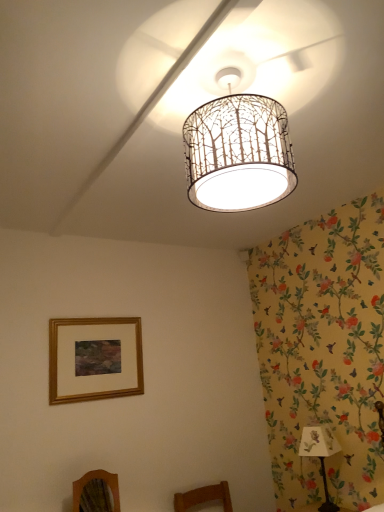
What do you see at coordinates (94, 359) in the screenshot? This screenshot has width=384, height=512. I see `gold wooden picture frame at lower left` at bounding box center [94, 359].

At what (x,y) coordinates should I click in order to perform the action: click on white paper shade at lower right. Please return your answer as a coordinate pair (x, y). Looking at the image, I should click on (320, 454).

Measure the distance between white paper shade at lower right and camera.

A distance of 8.10 feet exists between white paper shade at lower right and camera.

Find the location of a particular element. The height and width of the screenshot is (512, 384). gold wooden picture frame at lower left is located at coordinates (94, 359).

Which is behind, point (76, 490) or point (122, 360)?

Point (122, 360)

Could you tell me if wooden mirror at lower left is facing gold wooden picture frame at lower left?

No, wooden mirror at lower left is not turned towards gold wooden picture frame at lower left.

Locate an element on the screen. furniture that appears in front of the gold wooden picture frame at lower left is located at coordinates (96, 492).

From a real-world perspective, does wooden mirror at lower left stand above gold wooden picture frame at lower left?

No, from a real-world perspective, wooden mirror at lower left is not over gold wooden picture frame at lower left

Locate an element on the screen. This screenshot has width=384, height=512. picture frame located above the white paper shade at lower right (from the image's perspective) is located at coordinates (94, 359).

Is gold wooden picture frame at lower left at the back of white paper shade at lower right?

No.

Considering the positions of objects white paper shade at lower right and gold wooden picture frame at lower left in the image provided, who is more to the left, white paper shade at lower right or gold wooden picture frame at lower left?

gold wooden picture frame at lower left is more to the left.

Does white paper lampshade at center touch gold wooden picture frame at lower left?

No, white paper lampshade at center is not next to gold wooden picture frame at lower left.

Which object is closer to the camera taking this photo, white paper lampshade at center or gold wooden picture frame at lower left?

white paper lampshade at center.

Would you say gold wooden picture frame at lower left is part of white paper lampshade at center's contents?

No, gold wooden picture frame at lower left is not surrounded by white paper lampshade at center.

Looking at the image, does white paper lampshade at center seem bigger or smaller compared to gold wooden picture frame at lower left?

In the image, white paper lampshade at center appears to be larger than gold wooden picture frame at lower left.

Considering the sizes of objects white paper lampshade at center and wooden mirror at lower left in the image provided, who is wider, white paper lampshade at center or wooden mirror at lower left?

white paper lampshade at center is wider.

You are a GUI agent. You are given a task and a screenshot of the screen. Output one action in this format:
    pyautogui.click(x=<x>, y=<y>)
    Task: Click on the lamp in front of the wooden mirror at lower left
    
    Given the screenshot: What is the action you would take?
    pyautogui.click(x=238, y=151)

Does white paper lampshade at center turn towards wooden mirror at lower left?

No, white paper lampshade at center is not turned towards wooden mirror at lower left.

Is white paper lampshade at center inside the boundaries of wooden mirror at lower left, or outside?

white paper lampshade at center lies outside wooden mirror at lower left.

Is gold wooden picture frame at lower left next to white paper lampshade at center and touching it?

No, gold wooden picture frame at lower left is not touching white paper lampshade at center.

Considering the sizes of objects gold wooden picture frame at lower left and white paper lampshade at center in the image provided, who is taller, gold wooden picture frame at lower left or white paper lampshade at center?

With more height is gold wooden picture frame at lower left.

Which object is further away from the camera, gold wooden picture frame at lower left or white paper lampshade at center?

gold wooden picture frame at lower left.

Which of these two, gold wooden picture frame at lower left or white paper lampshade at center, is bigger?

With larger size is white paper lampshade at center.

Would you say white paper lampshade at center contains white paper shade at lower right?

No, white paper shade at lower right is not a part of white paper lampshade at center.

Considering the positions of point (221, 101) and point (336, 452), is point (221, 101) closer or farther from the camera than point (336, 452)?

Point (221, 101) appears to be closer to the viewer than point (336, 452).

Is white paper lampshade at center oriented away from white paper shade at lower right?

No, white paper lampshade at center's orientation is not away from white paper shade at lower right.

From a real-world perspective, between white paper lampshade at center and white paper shade at lower right, who is vertically lower?

white paper shade at lower right.

From a real-world perspective, is gold wooden picture frame at lower left above or below white paper shade at lower right?

From a real-world perspective, gold wooden picture frame at lower left is physically above white paper shade at lower right.

Is gold wooden picture frame at lower left aimed at white paper shade at lower right?

No, gold wooden picture frame at lower left is not facing towards white paper shade at lower right.

You are a GUI agent. You are given a task and a screenshot of the screen. Output one action in this format:
    pyautogui.click(x=<x>, y=<y>)
    Task: Click on the table lamp below the gold wooden picture frame at lower left (from the image's perspective)
    The height and width of the screenshot is (512, 384).
    Given the screenshot: What is the action you would take?
    pyautogui.click(x=320, y=454)

This screenshot has height=512, width=384. Identify the location of picture frame above the wooden mirror at lower left (from a real-world perspective). (94, 359).

I want to click on table lamp beneath the gold wooden picture frame at lower left (from a real-world perspective), so click(320, 454).

Looking at this image, based on their spatial positions, is white paper shade at lower right or gold wooden picture frame at lower left further from white paper lampshade at center?

white paper shade at lower right is further to white paper lampshade at center.

Considering their positions, is white paper lampshade at center positioned further to wooden mirror at lower left than white paper shade at lower right?

white paper lampshade at center is further to wooden mirror at lower left.

Based on their spatial positions, is gold wooden picture frame at lower left or wooden mirror at lower left further from white paper lampshade at center?

wooden mirror at lower left lies further to white paper lampshade at center than the other object.

Looking at the image, which one is located closer to white paper shade at lower right, gold wooden picture frame at lower left or white paper lampshade at center?

Among the two, gold wooden picture frame at lower left is located nearer to white paper shade at lower right.

When comparing their distances from white paper lampshade at center, does wooden mirror at lower left or gold wooden picture frame at lower left seem closer?

The object closer to white paper lampshade at center is gold wooden picture frame at lower left.

Considering their positions, is wooden mirror at lower left positioned further to white paper shade at lower right than white paper lampshade at center?

Based on the image, white paper lampshade at center appears to be further to white paper shade at lower right.

Based on their spatial positions, is gold wooden picture frame at lower left or white paper shade at lower right further from white paper lampshade at center?

white paper shade at lower right is further to white paper lampshade at center.

Estimate the real-world distances between objects in this image. Which object is further from white paper lampshade at center, wooden mirror at lower left or white paper shade at lower right?

Among the two, white paper shade at lower right is located further to white paper lampshade at center.

Where is `picture frame between white paper lampshade at center and white paper shade at lower right from top to bottom`? The width and height of the screenshot is (384, 512). picture frame between white paper lampshade at center and white paper shade at lower right from top to bottom is located at coordinates (94, 359).

This screenshot has width=384, height=512. In order to click on picture frame between white paper lampshade at center and wooden mirror at lower left in the vertical direction in this screenshot , I will do `click(94, 359)`.

You are a GUI agent. You are given a task and a screenshot of the screen. Output one action in this format:
    pyautogui.click(x=<x>, y=<y>)
    Task: Click on the furniture between white paper lampshade at center and white paper shade at lower right from top to bottom
    
    Given the screenshot: What is the action you would take?
    pyautogui.click(x=96, y=492)

The width and height of the screenshot is (384, 512). I want to click on furniture situated between gold wooden picture frame at lower left and white paper shade at lower right from left to right, so click(96, 492).